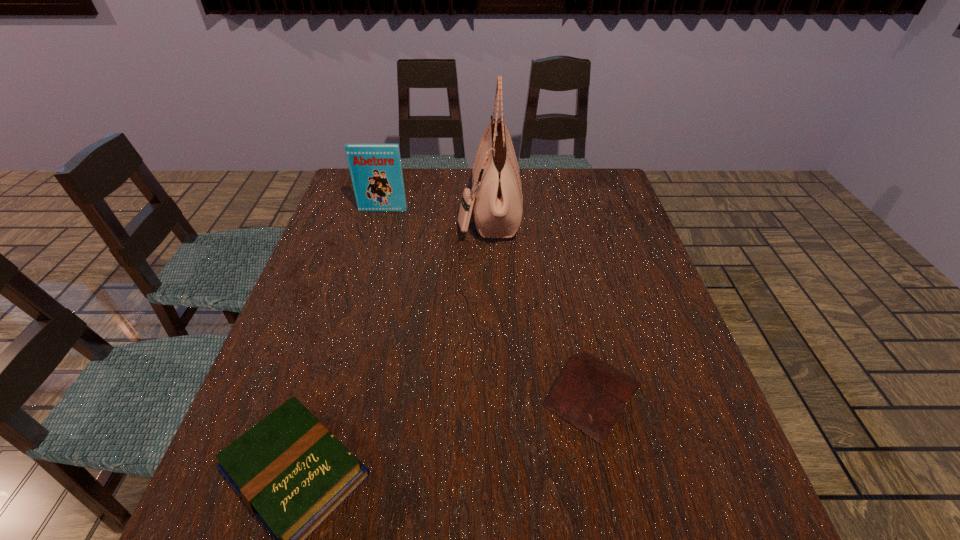
Locate an element on the screen. The height and width of the screenshot is (540, 960). empty space that is in between the rightmost book and the handbag is located at coordinates (540, 303).

The height and width of the screenshot is (540, 960). Identify the location of unoccupied area between the tallest book and the tallest object. (436, 210).

Locate which object ranks in proximity to the tallest object. Please provide its 2D coordinates. Your answer should be formatted as a tuple, i.e. [(x, y)], where the tuple contains the x and y coordinates of a point satisfying the conditions above.

[(376, 171)]

You are a GUI agent. You are given a task and a screenshot of the screen. Output one action in this format:
    pyautogui.click(x=<x>, y=<y>)
    Task: Click on the object identified as the third closest to the tallest book
    The height and width of the screenshot is (540, 960).
    Given the screenshot: What is the action you would take?
    pyautogui.click(x=292, y=472)

Image resolution: width=960 pixels, height=540 pixels. I want to click on book that stands as the closest to the farthest book, so click(588, 393).

Select which book is the second closest to the tallest book. Please provide its 2D coordinates. Your answer should be formatted as a tuple, i.e. [(x, y)], where the tuple contains the x and y coordinates of a point satisfying the conditions above.

[(292, 472)]

Where is `free space that satisfies the following two spatial constraints: 1. on the side of the tallest object with the attached pouch; 2. on the back side of the rightmost book`? Image resolution: width=960 pixels, height=540 pixels. free space that satisfies the following two spatial constraints: 1. on the side of the tallest object with the attached pouch; 2. on the back side of the rightmost book is located at coordinates (493, 395).

Identify the location of vacant space that satisfies the following two spatial constraints: 1. on the side of the rightmost book with the attached pouch; 2. on the right side of the tallest object. This screenshot has width=960, height=540. (493, 395).

Where is `vacant space that satisfies the following two spatial constraints: 1. on the side of the rightmost book with the attached pouch; 2. on the left side of the handbag`? The height and width of the screenshot is (540, 960). vacant space that satisfies the following two spatial constraints: 1. on the side of the rightmost book with the attached pouch; 2. on the left side of the handbag is located at coordinates (493, 395).

You are a GUI agent. You are given a task and a screenshot of the screen. Output one action in this format:
    pyautogui.click(x=<x>, y=<y>)
    Task: Click on the vacant position in the image that satisfies the following two spatial constraints: 1. on the side of the handbag with the attached pouch; 2. on the right side of the rightmost book
    
    Given the screenshot: What is the action you would take?
    pyautogui.click(x=493, y=395)